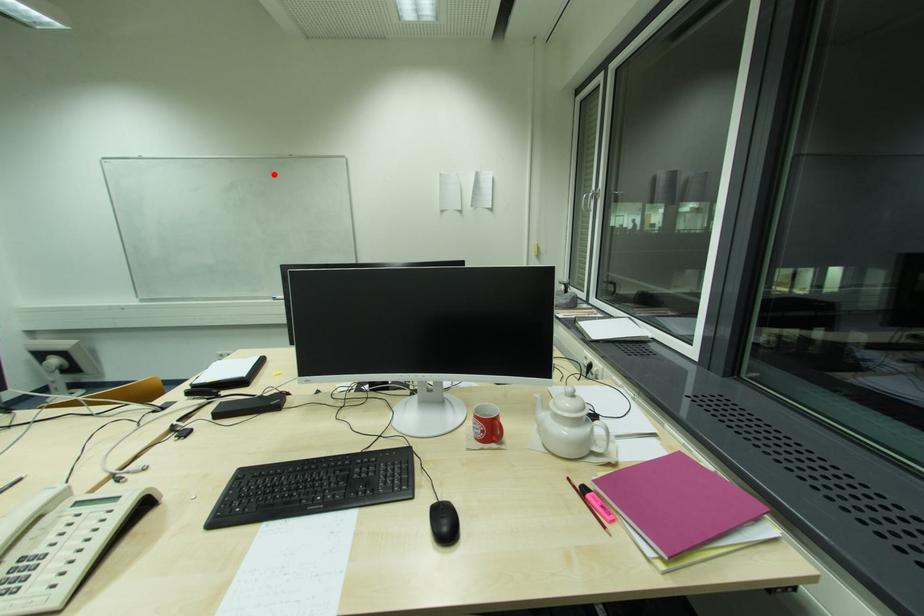
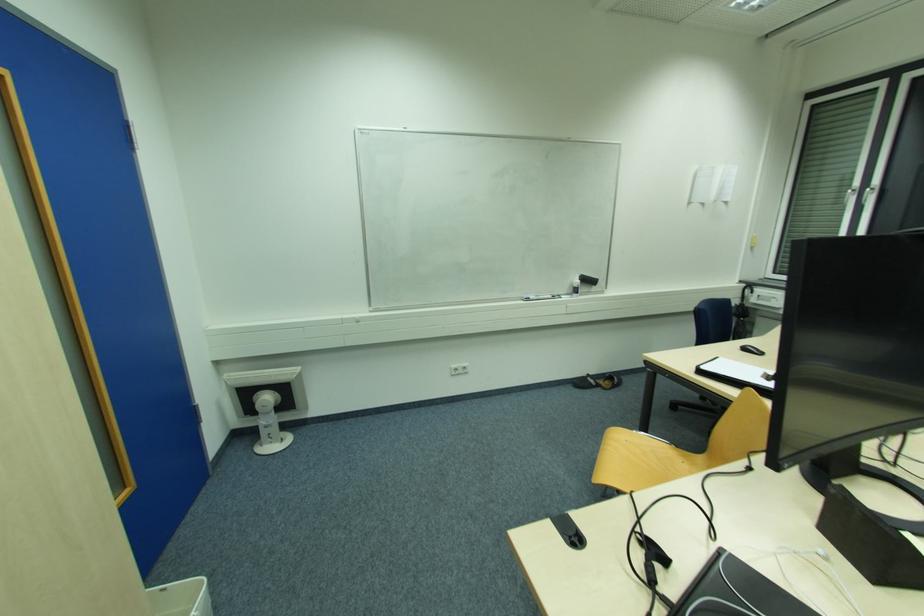
Find the pixel in the second image that matches the highlighted location in the first image.

(550, 158)